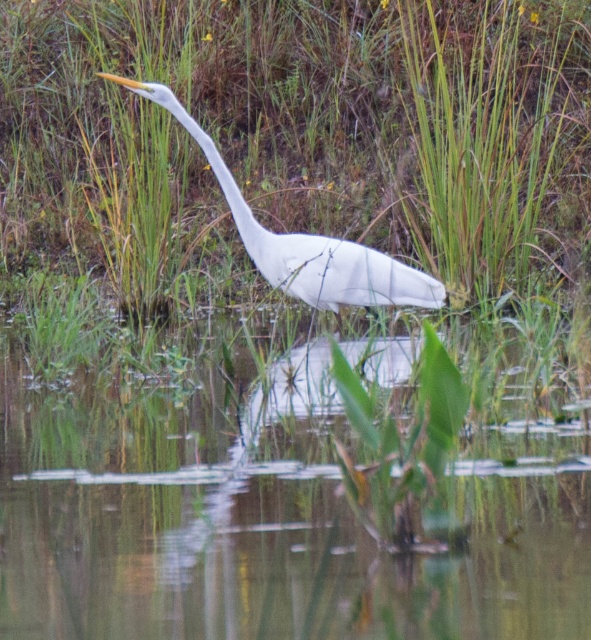
You are a photographer trying to capture the reflection of the Great Egret in the transparent plastic water at center. According to the coordinates provided, where exactly should you position your camera to ensure the reflection is centered in your shot?

The transparent plastic water at center is located at coordinates point (268,522), so positioning the camera at this point will ensure the reflection of the Great Egret is centered in the shot.

You are a photographer standing at the edge of the wetland. You want to take a photo of the two points in the scene. Which point, point [278,525] or point [379,260], will appear larger in your photo?

Point [278,525] will appear larger in the photo because it is closer to the camera than point [379,260].